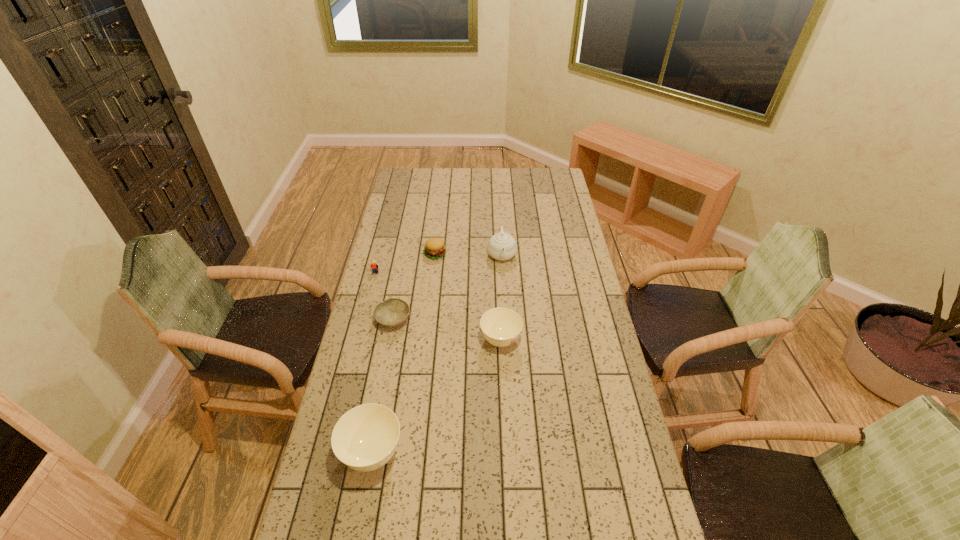
Find the location of a particular element. Image resolution: width=960 pixels, height=540 pixels. free space at the left edge is located at coordinates (419, 212).

This screenshot has width=960, height=540. I want to click on free region at the right edge, so (600, 377).

Identify the location of free region at the far right corner of the desktop. (554, 177).

The height and width of the screenshot is (540, 960). Identify the location of free space between the chinaware and the hamburger. (468, 254).

I want to click on free space that is in between the hamburger and the leftmost object, so click(405, 264).

The image size is (960, 540). I want to click on empty location between the chinaware and the shortest object, so tap(447, 287).

Find the location of a particular element. The width and height of the screenshot is (960, 540). free spot between the farther sugar bowl and the left sugar bowl is located at coordinates (437, 396).

At what (x,y) coordinates should I click in order to perform the action: click on empty space that is in between the taller sugar bowl and the chinaware. Please return your answer as a coordinate pair (x, y). The height and width of the screenshot is (540, 960). Looking at the image, I should click on (437, 354).

Locate an element on the screen. unoccupied area between the chinaware and the taller sugar bowl is located at coordinates (437, 354).

Locate an element on the screen. This screenshot has width=960, height=540. vacant point located between the fifth tallest object and the bowl is located at coordinates (414, 287).